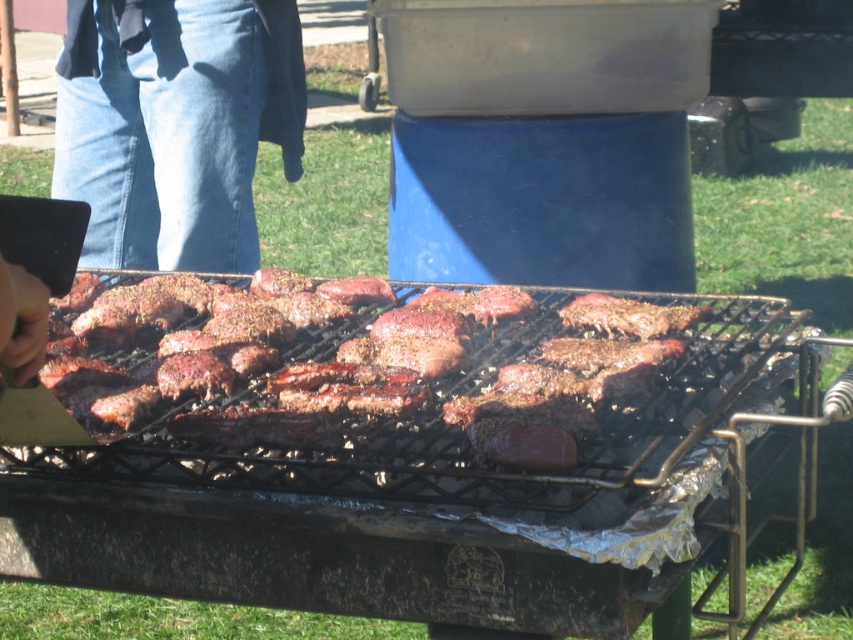
Who is shorter, grilled meat at center or denim jeans at left?

grilled meat at center is shorter.

What are the coordinates of `grilled meat at center` in the screenshot? It's located at (386, 376).

Locate an element on the screen. grilled meat at center is located at coordinates (386, 376).